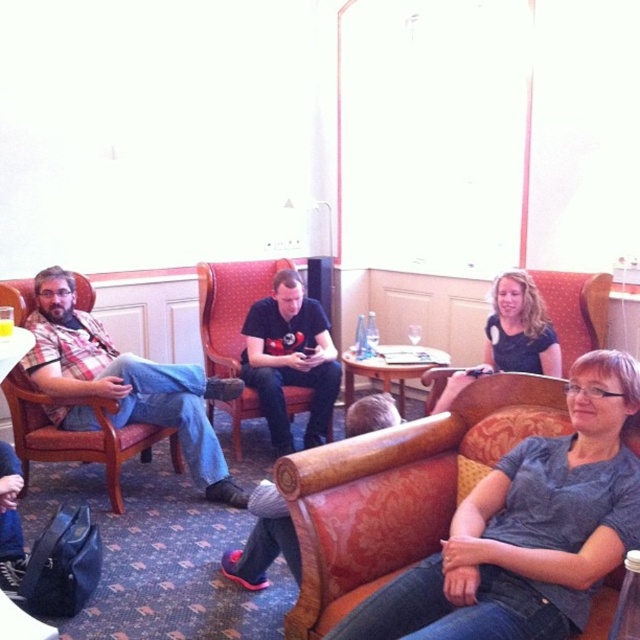
Between gray cotton shirt at center and black matte shirt at center, which one has less height?

Standing shorter between the two is gray cotton shirt at center.

Is gray cotton shirt at center closer to the viewer compared to black matte shirt at center?

Yes.

Find the location of `gray cotton shirt at center`. gray cotton shirt at center is located at coordinates (528, 529).

Which of these two, black matte shirt at center or velvet-like orange armchair at center, stands shorter?

velvet-like orange armchair at center

Based on the photo, is black matte shirt at center below velvet-like orange armchair at center?

Yes.

Between point (282, 336) and point (602, 307), which one is positioned in front?

Point (602, 307) is in front.

Locate an element on the screen. Image resolution: width=640 pixels, height=640 pixels. black matte shirt at center is located at coordinates (291, 358).

Can you confirm if plaid fabric shirt at left is positioned above velvet-like orange armchair at center?

Actually, plaid fabric shirt at left is below velvet-like orange armchair at center.

Does plaid fabric shirt at left lie in front of velvet-like orange armchair at center?

That is True.

Image resolution: width=640 pixels, height=640 pixels. What are the coordinates of `plaid fabric shirt at left` in the screenshot? It's located at pos(124,384).